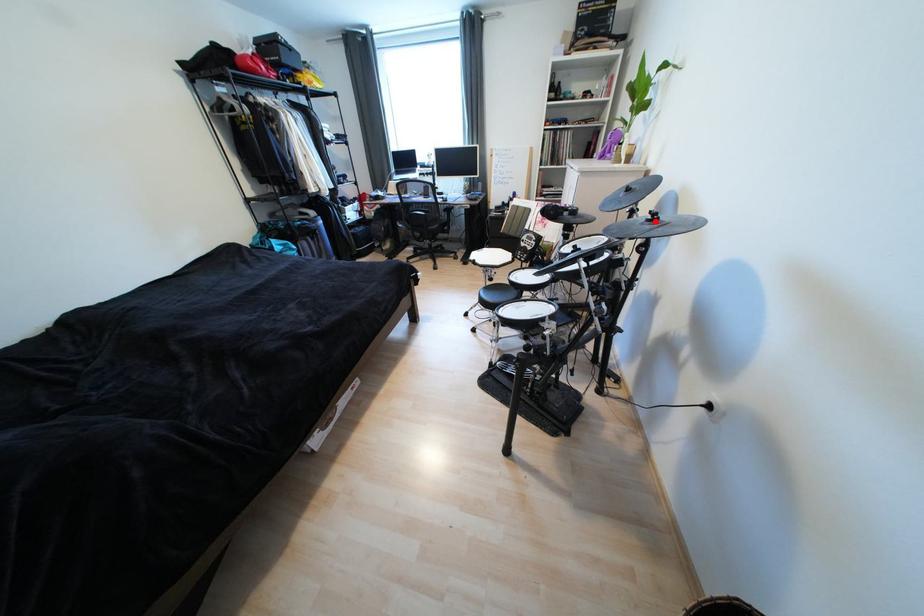
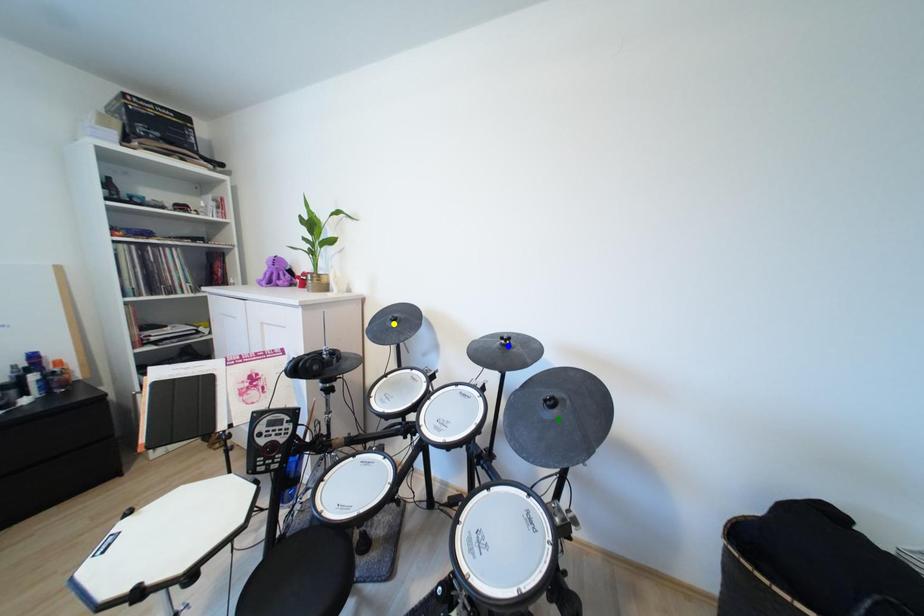
Question: I am providing you with two images of the same scene from different viewpoints. A red point is marked on the first image. You are given multiple points on the second image. In image 2, which mark is for the same physical point as the one in image 1?

Choices:
 (A) yellow point
 (B) blue point
 (C) green point

Answer: (B)